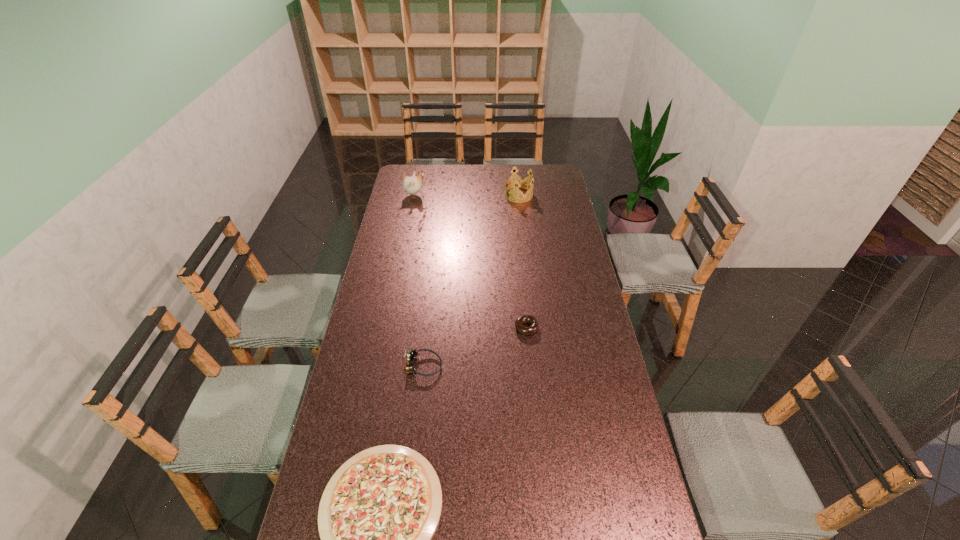
Where is `vacant space in between the second tallest object and the bird`? This screenshot has height=540, width=960. vacant space in between the second tallest object and the bird is located at coordinates (467, 195).

Where is `free space between the doughnut and the fourth shortest object`? The width and height of the screenshot is (960, 540). free space between the doughnut and the fourth shortest object is located at coordinates (522, 261).

Locate an element on the screen. This screenshot has width=960, height=540. object that is the second closest to the nearest object is located at coordinates (522, 319).

Select which object appears as the closest to the shortest object. Please provide its 2D coordinates. Your answer should be formatted as a tuple, i.e. [(x, y)], where the tuple contains the x and y coordinates of a point satisfying the conditions above.

[(411, 354)]

Locate an element on the screen. This screenshot has height=540, width=960. free region that satisfies the following two spatial constraints: 1. at the beak of the bird; 2. on the left side of the fourth tallest object is located at coordinates (389, 328).

This screenshot has width=960, height=540. I want to click on vacant space that satisfies the following two spatial constraints: 1. on the front side of the crown; 2. at the beak of the bird, so click(x=518, y=195).

Image resolution: width=960 pixels, height=540 pixels. In order to click on vacant space that satisfies the following two spatial constraints: 1. on the back side of the second shortest object; 2. at the beak of the bird in this screenshot , I will do `click(514, 195)`.